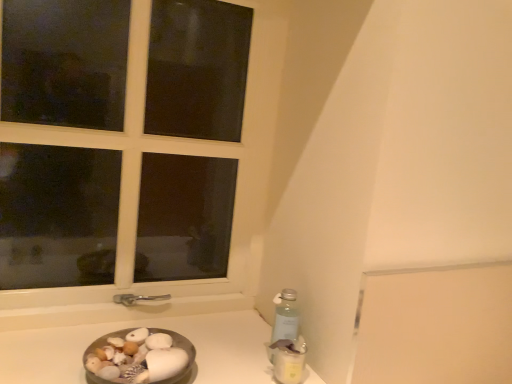
Question: Considering the relative positions of smooth white shells at lower left and metallic silver bowl at lower left in the image provided, is smooth white shells at lower left in front of metallic silver bowl at lower left?

Choices:
 (A) no
 (B) yes

Answer: (A)

Question: Would you say smooth white shells at lower left is outside metallic silver bowl at lower left?

Choices:
 (A) yes
 (B) no

Answer: (A)

Question: Can you confirm if smooth white shells at lower left is smaller than metallic silver bowl at lower left?

Choices:
 (A) no
 (B) yes

Answer: (B)

Question: Can you confirm if smooth white shells at lower left is bigger than metallic silver bowl at lower left?

Choices:
 (A) yes
 (B) no

Answer: (B)

Question: Is the position of smooth white shells at lower left more distant than that of metallic silver bowl at lower left?

Choices:
 (A) yes
 (B) no

Answer: (A)

Question: Looking at their shapes, would you say white plastic window at upper left is wider or thinner than smooth white shells at lower left?

Choices:
 (A) thin
 (B) wide

Answer: (A)

Question: Is white plastic window at upper left bigger or smaller than smooth white shells at lower left?

Choices:
 (A) small
 (B) big

Answer: (B)

Question: Is white plastic window at upper left inside the boundaries of smooth white shells at lower left, or outside?

Choices:
 (A) outside
 (B) inside

Answer: (A)

Question: Visually, is white plastic window at upper left positioned to the left or to the right of smooth white shells at lower left?

Choices:
 (A) right
 (B) left

Answer: (B)

Question: Considering the positions of white plastic window at upper left and translucent plastic bottle at lower right in the image, is white plastic window at upper left bigger or smaller than translucent plastic bottle at lower right?

Choices:
 (A) big
 (B) small

Answer: (A)

Question: From the image's perspective, relative to translucent plastic bottle at lower right, is white plastic window at upper left above or below?

Choices:
 (A) below
 (B) above

Answer: (B)

Question: Is white plastic window at upper left in front of or behind translucent plastic bottle at lower right in the image?

Choices:
 (A) front
 (B) behind

Answer: (A)

Question: In terms of height, does white plastic window at upper left look taller or shorter compared to translucent plastic bottle at lower right?

Choices:
 (A) short
 (B) tall

Answer: (B)

Question: Considering the positions of smooth white shells at lower left and white plastic window at upper left in the image, is smooth white shells at lower left bigger or smaller than white plastic window at upper left?

Choices:
 (A) small
 (B) big

Answer: (A)

Question: From the image's perspective, is smooth white shells at lower left positioned above or below white plastic window at upper left?

Choices:
 (A) above
 (B) below

Answer: (B)